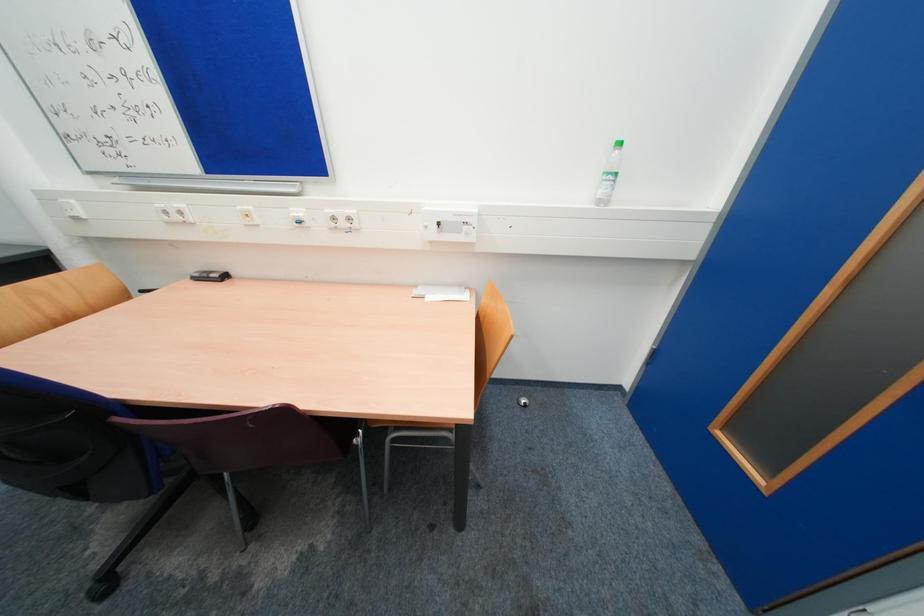
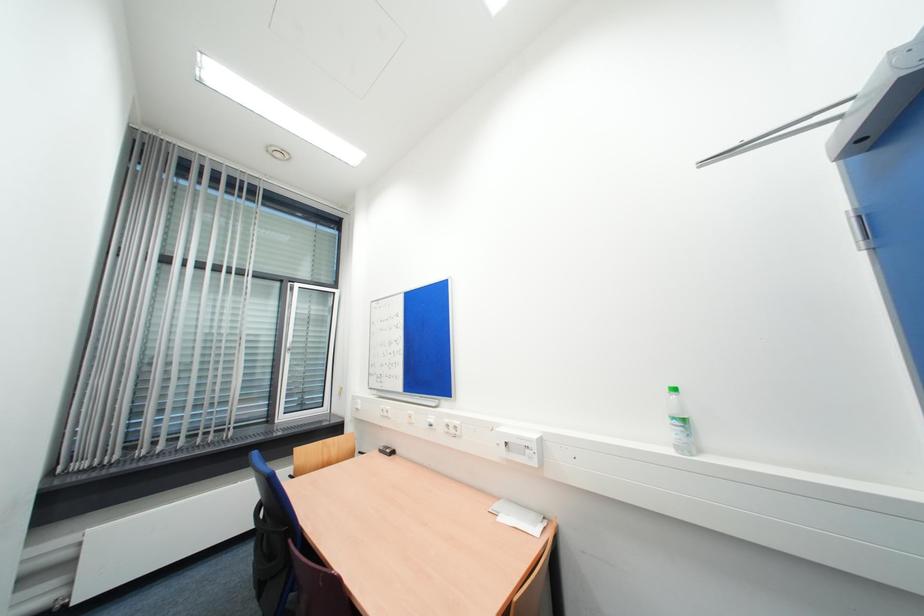
The images are taken continuously from a first-person perspective. In which direction is your viewpoint rotating?

The rotation direction of the camera is left-up.